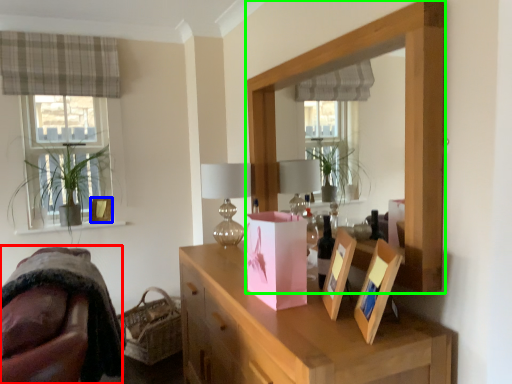
Question: Which is farther away from swivel chair (highlighted by a red box)? picture frame (highlighted by a blue box) or mirror (highlighted by a green box)?

Choices:
 (A) picture frame
 (B) mirror

Answer: (A)